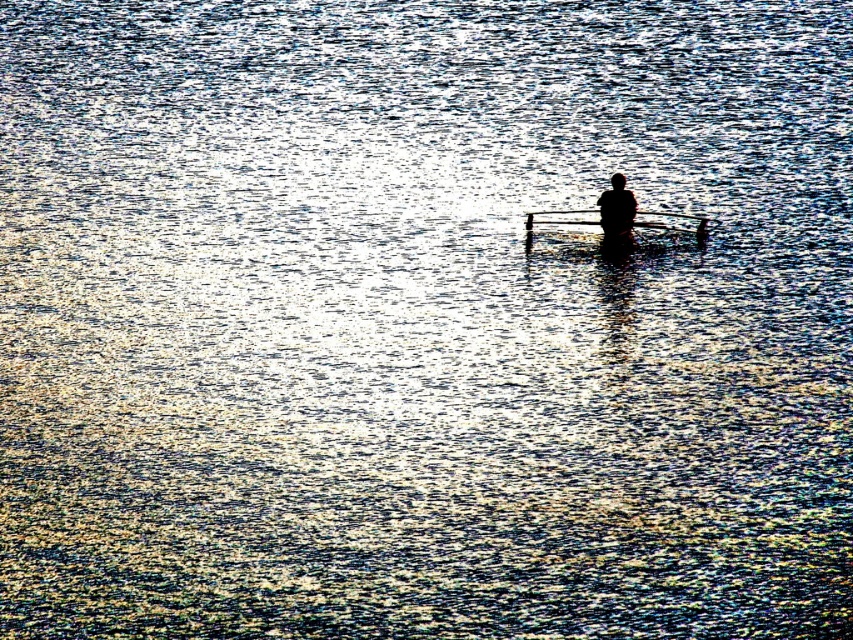
Does transparent plastic paddle at center have a greater width compared to black matte figure at center?

Indeed, transparent plastic paddle at center has a greater width compared to black matte figure at center.

Measure the distance between transparent plastic paddle at center and camera.

transparent plastic paddle at center is 86.68 feet away from camera.

Is point (582, 221) positioned in front of point (616, 173)?

Yes, it is.

Where is `transparent plastic paddle at center`? transparent plastic paddle at center is located at coordinates (670, 221).

Can you confirm if smooth wood canoe at center is positioned above transparent plastic paddle at center?

Incorrect, smooth wood canoe at center is not positioned above transparent plastic paddle at center.

Measure the distance from smooth wood canoe at center to transparent plastic paddle at center.

smooth wood canoe at center and transparent plastic paddle at center are 13.48 inches apart from each other.

The height and width of the screenshot is (640, 853). What are the coordinates of `smooth wood canoe at center` in the screenshot? It's located at (618, 227).

Identify the location of smooth wood canoe at center. Image resolution: width=853 pixels, height=640 pixels. (618, 227).

Does smooth wood canoe at center lie behind black matte figure at center?

Yes, it is.

Who is more forward, (579, 212) or (619, 236)?

Point (619, 236)

At what (x,y) coordinates should I click in order to perform the action: click on smooth wood canoe at center. Please return your answer as a coordinate pair (x, y). The image size is (853, 640). Looking at the image, I should click on (618, 227).